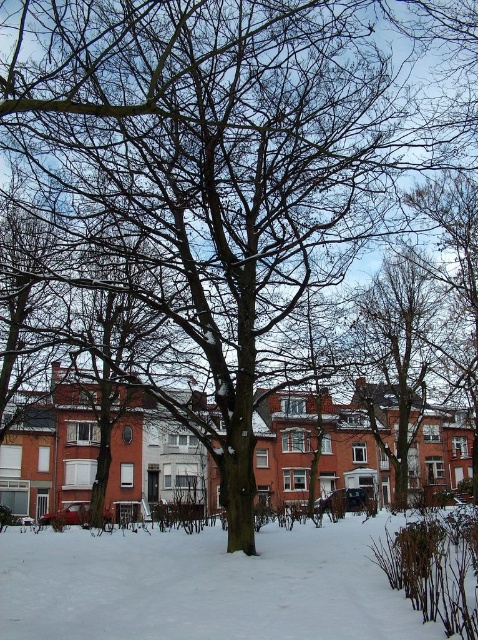
From the picture: Between white powdery snow at lower center and bare branches at upper center, which one is positioned lower?

Positioned lower is bare branches at upper center.

Between white powdery snow at lower center and bare branches at upper center, which one appears on the right side from the viewer's perspective?

Positioned to the right is bare branches at upper center.

This screenshot has height=640, width=478. Identify the location of white powdery snow at lower center. (204, 586).